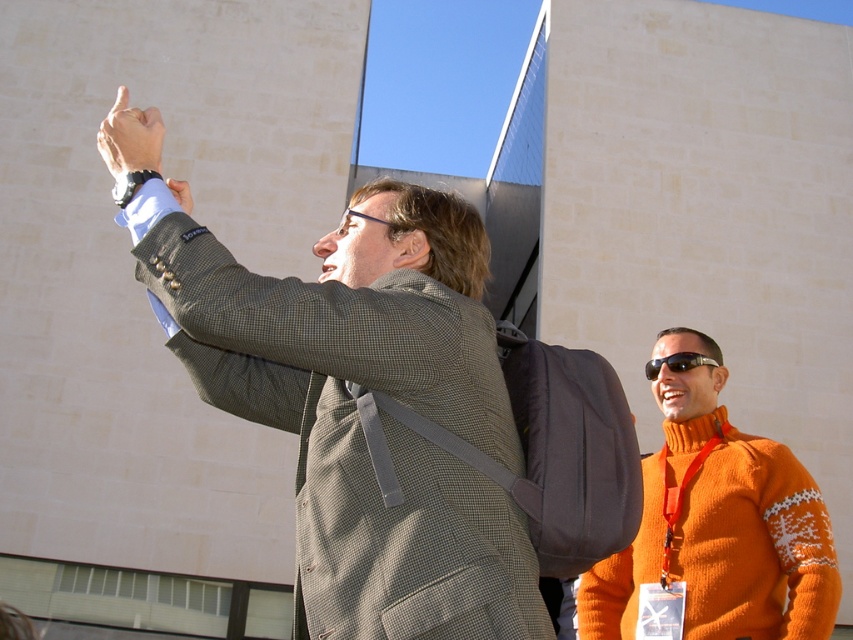
You are a photographer trying to capture a closeup of the orange knitted sweater at right and the black plastic sunglasses at upper right. Since you can only focus on one object at a time, which one should you choose to ensure it appears clearer in the photo?

The orange knitted sweater at right is larger in size than the black plastic sunglasses at upper right, so focusing on the orange knitted sweater at right will ensure it appears clearer in the photo.

You are standing in the scene and want to locate the orange knitted sweater at right. What are its coordinates?

The orange knitted sweater at right is located at coordinates 0.822 and 0.842.